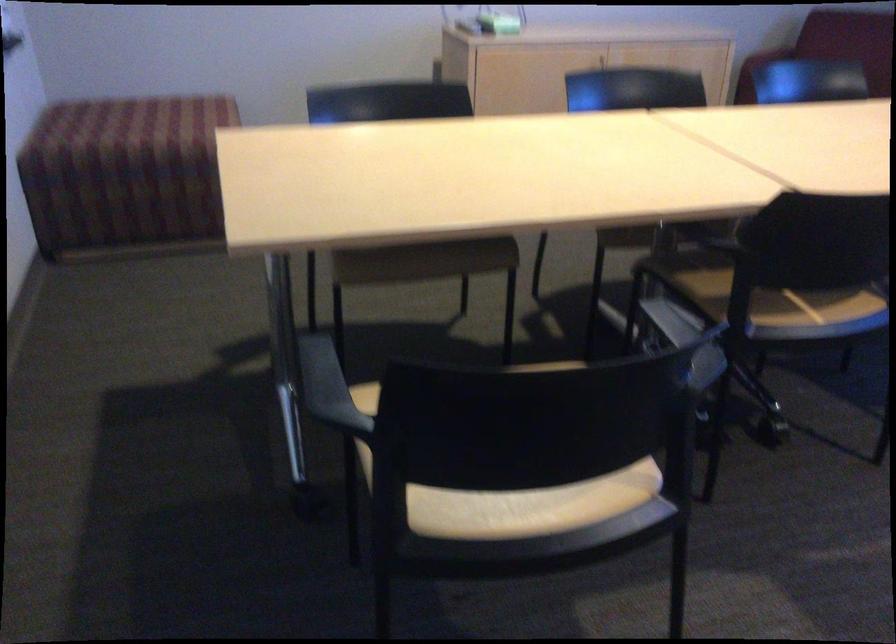
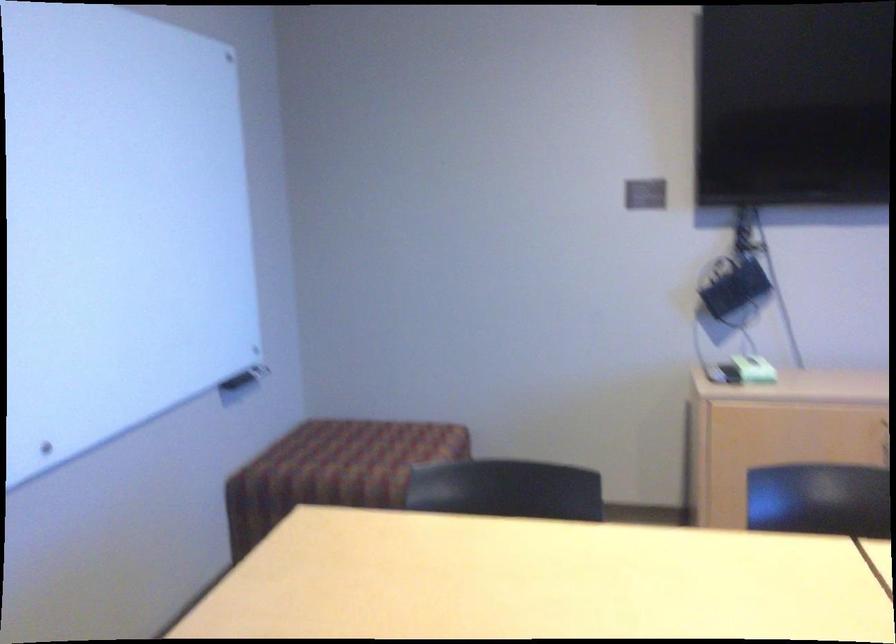
The images are taken continuously from a first-person perspective. In which direction is your viewpoint rotating?

The camera rotated toward left-up.